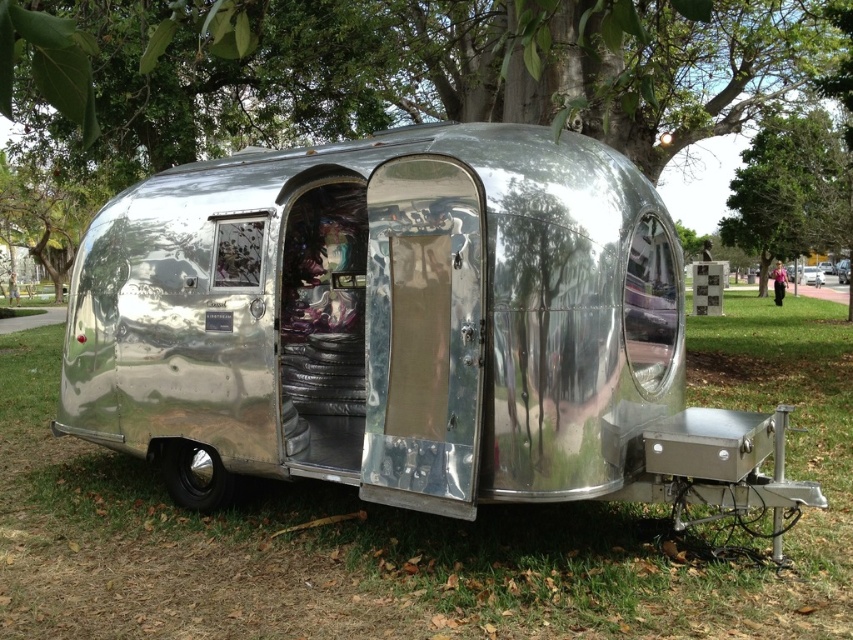
Question: Can you confirm if glossy bark tree at upper center is thinner than green leafy tree at upper center?

Choices:
 (A) yes
 (B) no

Answer: (B)

Question: Which of the following is the farthest from the observer?

Choices:
 (A) green leafy tree at upper center
 (B) glossy bark tree at upper center
 (C) green grass at lower center
 (D) shiny metallic trailer at center

Answer: (D)

Question: Which of the following is the closest to the observer?

Choices:
 (A) pos(729,333)
 (B) pos(769,172)

Answer: (A)

Question: Which of these objects is positioned closest to the green grass at lower center?

Choices:
 (A) shiny metallic trailer at center
 (B) green leafy tree at upper center
 (C) glossy bark tree at upper center

Answer: (C)

Question: From the image, what is the correct spatial relationship of green grass at lower center in relation to shiny metallic trailer at center?

Choices:
 (A) right
 (B) left

Answer: (B)

Question: Is green leafy tree at upper center closer to camera compared to shiny metallic trailer at center?

Choices:
 (A) no
 (B) yes

Answer: (B)